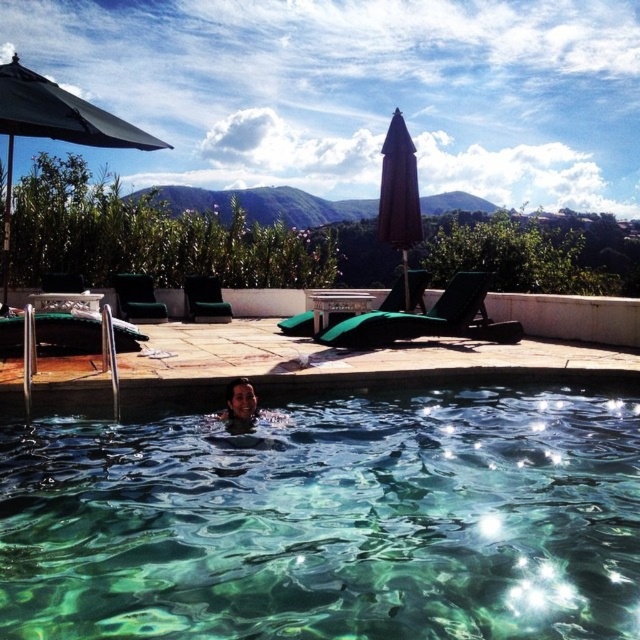
You are planning to set up a new umbrella on the deck between the green fabric umbrella at upper left and the brown fabric umbrella at upper center. Based on their positions, where should you place the new umbrella to ensure it is centered between them?

The green fabric umbrella at upper left is to the left of brown fabric umbrella at upper center, so placing the new umbrella exactly halfway between them would center it between the two existing umbrellas.

You are standing at the edge of the pool and want to check if your towel placed under the green fabric umbrella at upper left is within reach using a 5 meter long pool pole. Can you reach it?

The distance between you and the green fabric umbrella at upper left is 7.73 meters, which is longer than the 5 meter pool pole. Therefore, you cannot reach the towel under the green fabric umbrella at upper left with the pole.

You are a guest at this poolside area and want to place a small tray on the nearest available surface near the brown fabric umbrella at upper center and matte black hair at lower center. Which object should you choose to place the tray?

The brown fabric umbrella at upper center is to the right of matte black hair at lower center. Since the umbrella is positioned further away from the hair, you should place the tray on the brown fabric umbrella at upper center as it is the nearest available surface.